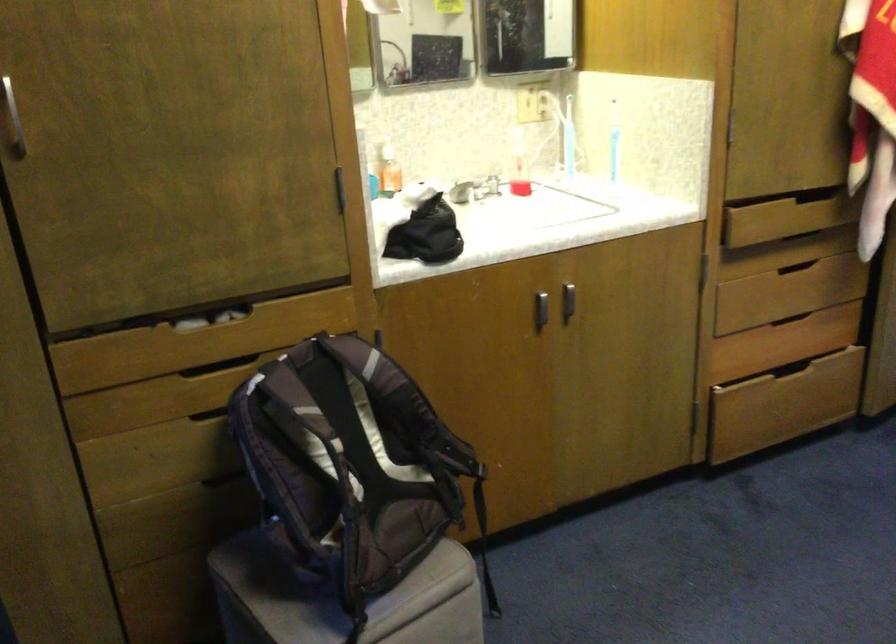
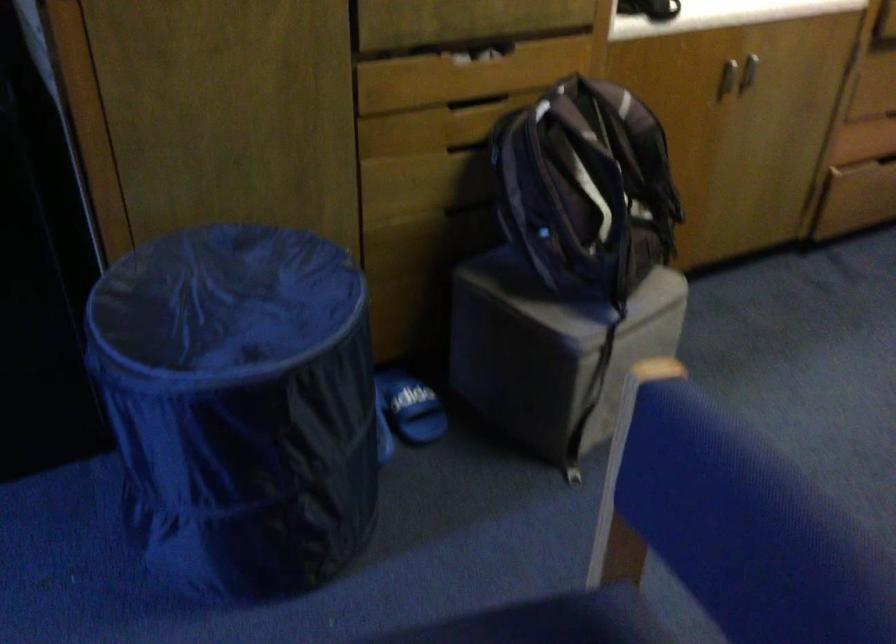
In the second image, find the point that corresponds to the point at 324,471 in the first image.

(586, 187)